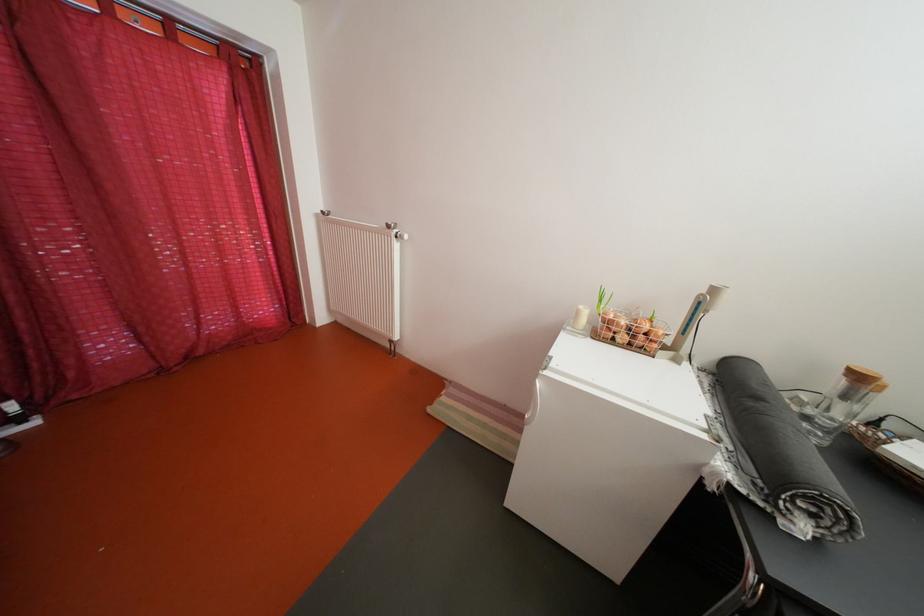
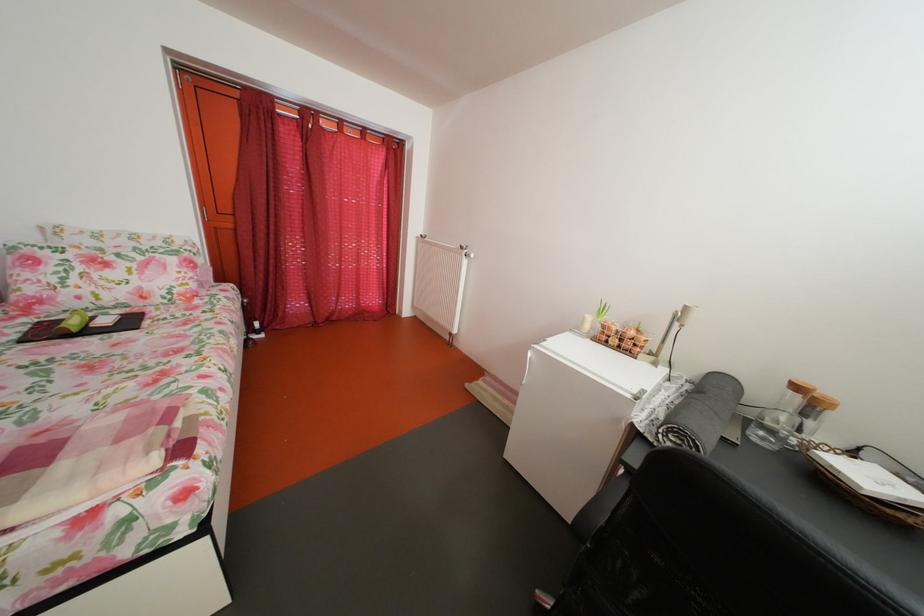
The point at (517, 511) is marked in the first image. Where is the corresponding point in the second image?

(517, 463)